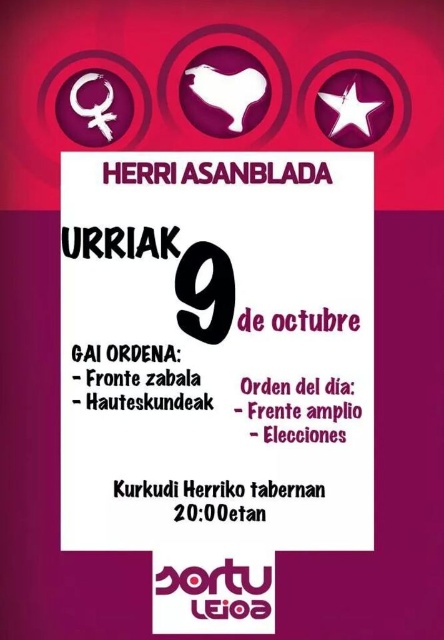
Looking at the promotional poster for the event, can you tell me the position of the white paper sign at center relative to the black paper number at center?

The white paper sign at center is located to the right of the black paper number at center.

You are looking at the promotional poster for the event. There are two points marked on the poster. The first point is at coordinates point (264, 496) and the second point is at point (186, 332). Which of these points appears closer to you?

The point at coordinates point (264, 496) is closer to the camera than point (186, 332), so it appears closer to you.